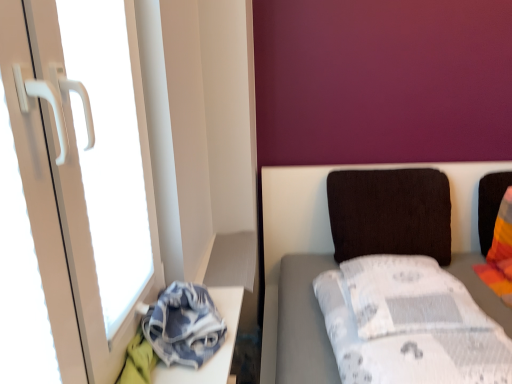
Question: Is white plastic screen door at left completely or partially inside denim fabric at lower left?

Choices:
 (A) no
 (B) yes

Answer: (A)

Question: Can you confirm if denim fabric at lower left is wider than white plastic screen door at left?

Choices:
 (A) no
 (B) yes

Answer: (B)

Question: Is the position of denim fabric at lower left less distant than that of white plastic screen door at left?

Choices:
 (A) no
 (B) yes

Answer: (A)

Question: From a real-world perspective, is denim fabric at lower left physically below white plastic screen door at left?

Choices:
 (A) no
 (B) yes

Answer: (B)

Question: Considering the relative sizes of denim fabric at lower left and white plastic screen door at left in the image provided, is denim fabric at lower left taller than white plastic screen door at left?

Choices:
 (A) yes
 (B) no

Answer: (B)

Question: Is point (397, 248) closer or farther from the camera than point (31, 44)?

Choices:
 (A) closer
 (B) farther

Answer: (B)

Question: Would you say dark brown fabric pillow at center-right is inside or outside white plastic screen door at left?

Choices:
 (A) outside
 (B) inside

Answer: (A)

Question: Considering the relative positions of dark brown fabric pillow at center-right and white plastic screen door at left in the image provided, is dark brown fabric pillow at center-right to the left or to the right of white plastic screen door at left?

Choices:
 (A) right
 (B) left

Answer: (A)

Question: Considering the positions of dark brown fabric pillow at center-right and white plastic screen door at left in the image, is dark brown fabric pillow at center-right wider or thinner than white plastic screen door at left?

Choices:
 (A) wide
 (B) thin

Answer: (A)

Question: From a real-world perspective, is white plastic screen door at left positioned above or below dark brown fabric pillow at center-right?

Choices:
 (A) above
 (B) below

Answer: (A)

Question: Considering their positions, is white plastic screen door at left located in front of or behind dark brown fabric pillow at center-right?

Choices:
 (A) behind
 (B) front

Answer: (B)

Question: Considering the positions of white plastic screen door at left and dark brown fabric pillow at center-right in the image, is white plastic screen door at left bigger or smaller than dark brown fabric pillow at center-right?

Choices:
 (A) small
 (B) big

Answer: (B)

Question: Is white plastic screen door at left to the left or to the right of dark brown fabric pillow at center-right in the image?

Choices:
 (A) left
 (B) right

Answer: (A)

Question: From the image's perspective, relative to dark brown fabric pillow at center-right, is white fabric bed at right above or below?

Choices:
 (A) below
 (B) above

Answer: (A)

Question: In the image, is white fabric bed at right positioned in front of or behind dark brown fabric pillow at center-right?

Choices:
 (A) behind
 (B) front

Answer: (B)